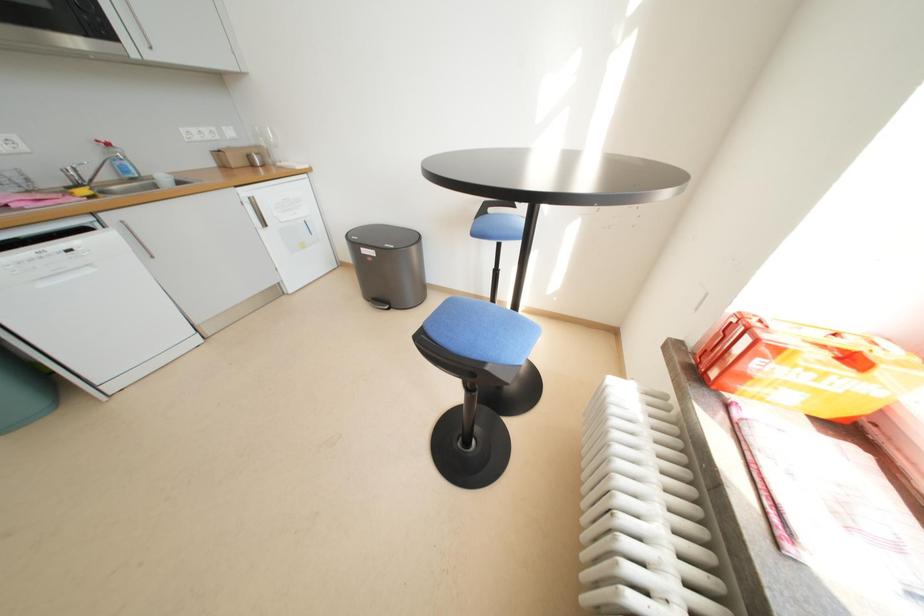
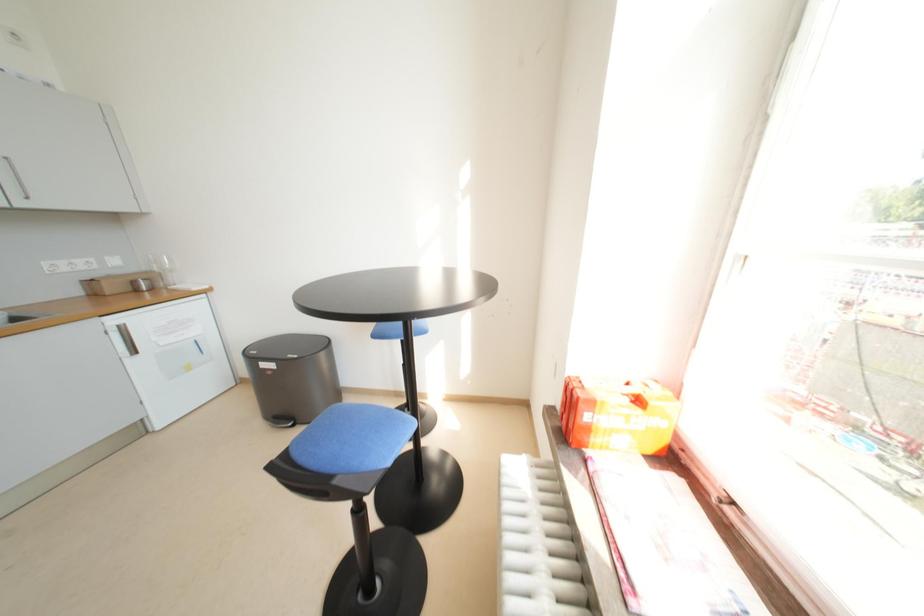
Question: The images are taken continuously from a first-person perspective. In which direction is your viewpoint rotating?

Choices:
 (A) Left
 (B) Right
 (C) Up
 (D) Down

Answer: (C)